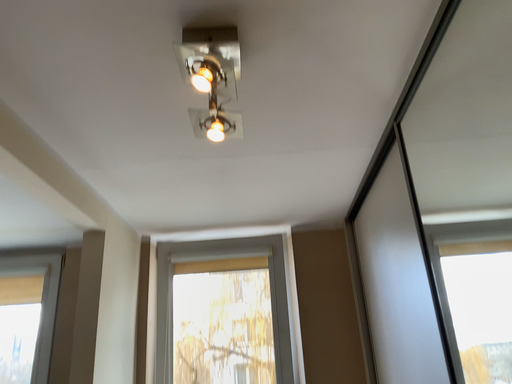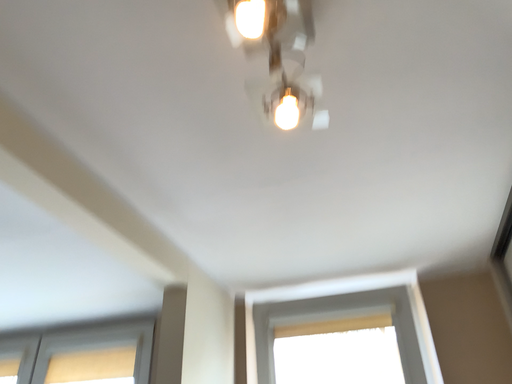
Question: How did the camera likely rotate when shooting the video?

Choices:
 (A) rotated left
 (B) rotated right

Answer: (A)